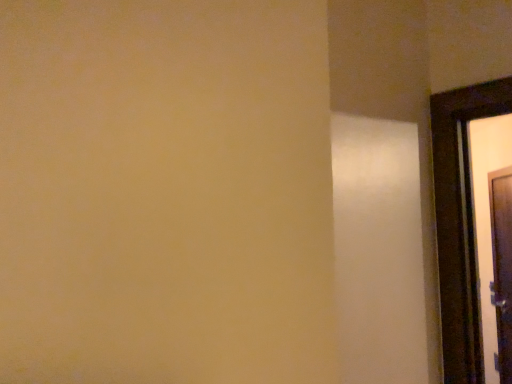
You are a GUI agent. You are given a task and a screenshot of the screen. Output one action in this format:
    pyautogui.click(x=<x>, y=<y>)
    Task: Click on the wooden door at right
    The height and width of the screenshot is (384, 512).
    Given the screenshot: What is the action you would take?
    tap(502, 267)

Describe the element at coordinates (502, 267) in the screenshot. I see `wooden door at right` at that location.

Find the location of a particular element. wooden door at right is located at coordinates (502, 267).